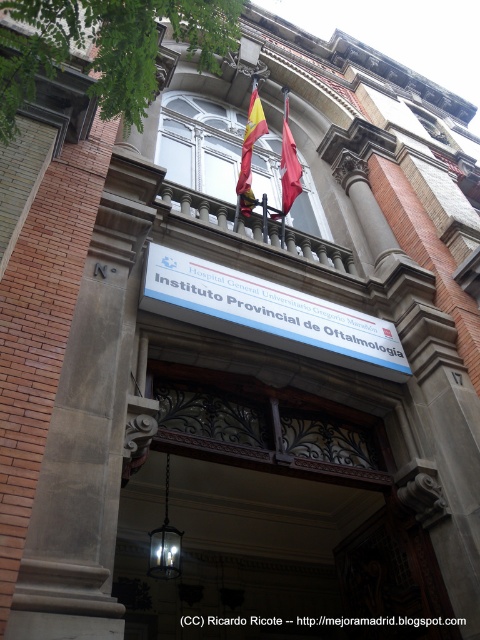
You are a visitor arriving at the Instituto Provincial de Oftalmology. You see the dark brown wooden door at center and the red fabric flag at upper center. Which object is taller?

The dark brown wooden door at center is much taller than the red fabric flag at upper center.

You are a maintenance worker who needs to hang a new 1.5 meter wide banner between the dark brown wooden door at center and the red fabric flag at center. Can you fit the banner in the space between them?

The distance between the dark brown wooden door at center and the red fabric flag at center is 12.85 meters, which is more than enough to accommodate a 1.5 meter wide banner between them.